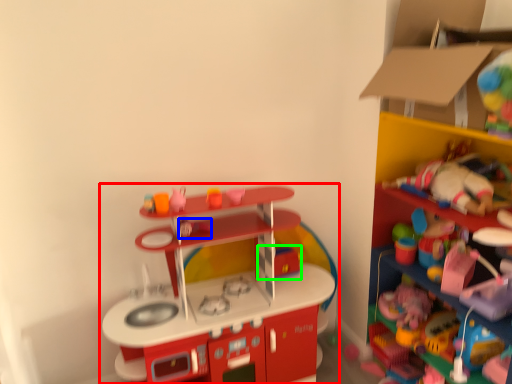
Question: Which is farther away from toy (highlighted by a red box)? toy (highlighted by a blue box) or toy (highlighted by a green box)?

Choices:
 (A) toy
 (B) toy

Answer: (A)